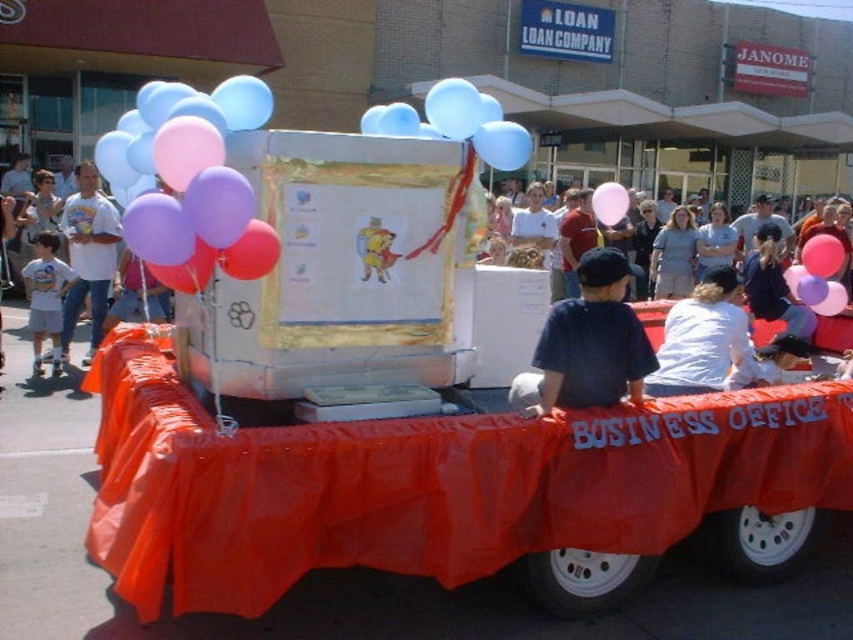
Question: Can you confirm if matte balloons at left is thinner than white t-shirt at left?

Choices:
 (A) no
 (B) yes

Answer: (B)

Question: Does dark blue cotton shirt at center appear under white cotton shirt at lower center?

Choices:
 (A) yes
 (B) no

Answer: (A)

Question: Which point is closer to the camera?

Choices:
 (A) pyautogui.click(x=601, y=211)
 (B) pyautogui.click(x=57, y=289)
 (C) pyautogui.click(x=202, y=140)
 (D) pyautogui.click(x=566, y=340)

Answer: (C)

Question: Which of the following is the farthest from the observer?

Choices:
 (A) white cotton shirt at lower center
 (B) matte white shirt at center

Answer: (A)

Question: Is dark blue cotton shirt at center further to the viewer compared to light blue latex balloon at upper center?

Choices:
 (A) yes
 (B) no

Answer: (B)

Question: Among these points, which one is farthest from the camera?

Choices:
 (A) (450, 115)
 (B) (619, 195)
 (C) (56, 307)

Answer: (C)